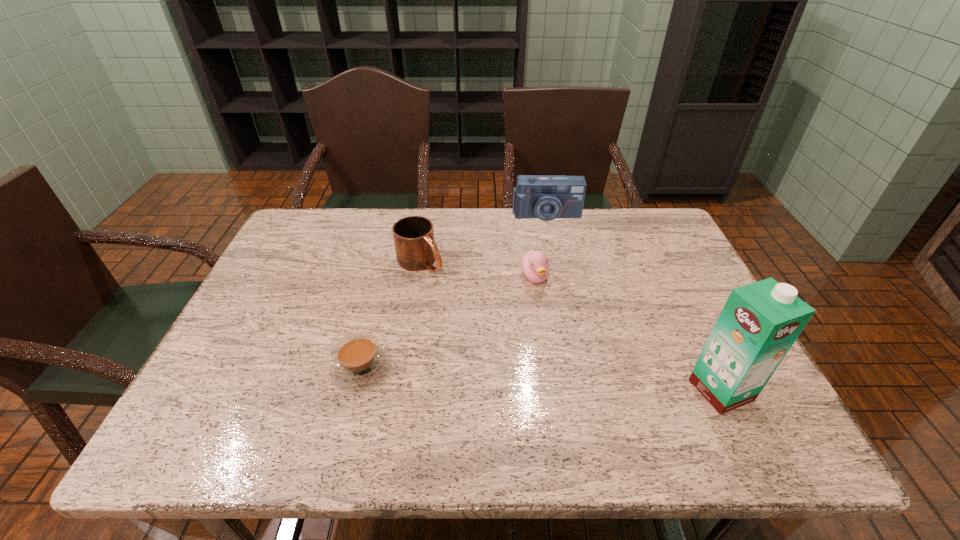
This screenshot has height=540, width=960. In order to click on cappuccino that is at the near edge in this screenshot , I will do `click(359, 362)`.

Where is `carton present at the near edge`? The height and width of the screenshot is (540, 960). carton present at the near edge is located at coordinates (760, 322).

This screenshot has height=540, width=960. I want to click on object located in the right edge section of the desktop, so point(760,322).

Locate an element on the screen. object that is at the near right corner is located at coordinates (760, 322).

At what (x,y) coordinates should I click in order to perform the action: click on vacant region at the far edge of the desktop. Please return your answer as a coordinate pair (x, y). The image size is (960, 540). Looking at the image, I should click on (524, 224).

Where is `free space at the near edge`? The image size is (960, 540). free space at the near edge is located at coordinates (330, 389).

The height and width of the screenshot is (540, 960). In the image, there is a desktop. Find the location of `vacant space at the left edge`. vacant space at the left edge is located at coordinates (275, 355).

The height and width of the screenshot is (540, 960). In the image, there is a desktop. In order to click on blank space at the right edge in this screenshot , I will do `click(684, 298)`.

Find the location of a particular element. The height and width of the screenshot is (540, 960). vacant space at the far left corner of the desktop is located at coordinates (341, 219).

Find the location of a particular element. vacant area at the far right corner is located at coordinates (659, 235).